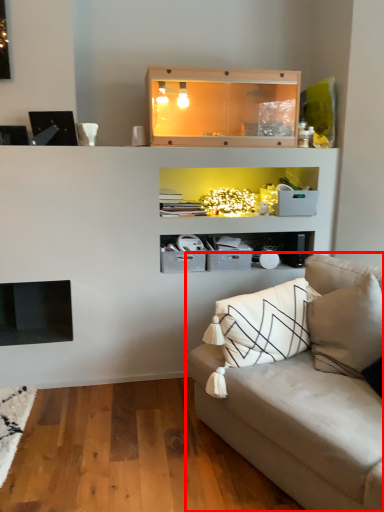
Question: From the image's perspective, what is the correct spatial positioning of studio couch (annotated by the red box) in reference to shelf?

Choices:
 (A) above
 (B) below

Answer: (B)